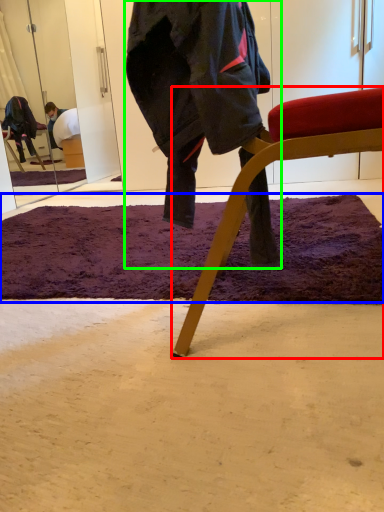
Question: Considering the real-world distances, which object is closest to chair (highlighted by a red box)? mat (highlighted by a blue box) or person (highlighted by a green box).

Choices:
 (A) mat
 (B) person

Answer: (B)